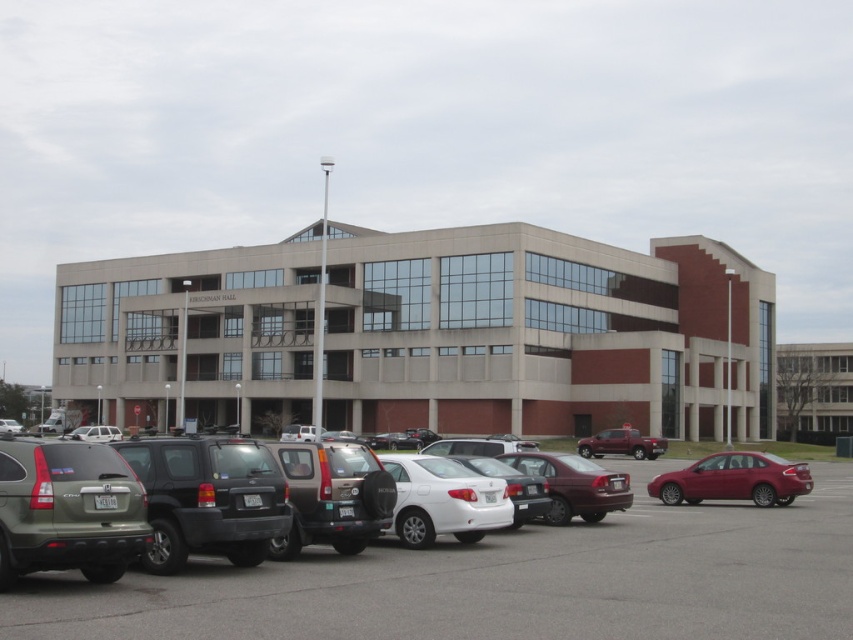
Can you confirm if metallic silver car at center is positioned above matte brown suv at center?

No, metallic silver car at center is not above matte brown suv at center.

Is point (239, 573) in front of point (322, 540)?

That is True.

Is point (410, 604) farther from viewer compared to point (296, 536)?

No, (410, 604) is in front of (296, 536).

Find the location of a particular element. This screenshot has width=853, height=640. metallic silver car at center is located at coordinates (503, 580).

Which is below, white glossy sedan at center or maroon matte sedan at center?

white glossy sedan at center is lower down.

Who is more distant from viewer, (x=419, y=477) or (x=520, y=458)?

Positioned behind is point (x=520, y=458).

Describe the element at coordinates (444, 499) in the screenshot. Image resolution: width=853 pixels, height=640 pixels. I see `white glossy sedan at center` at that location.

Identify the location of white glossy sedan at center. The height and width of the screenshot is (640, 853). (444, 499).

Which is more to the right, matte green suv at left or matte brown suv at center?

From the viewer's perspective, matte brown suv at center appears more on the right side.

The height and width of the screenshot is (640, 853). What are the coordinates of `matte green suv at left` in the screenshot? It's located at (68, 509).